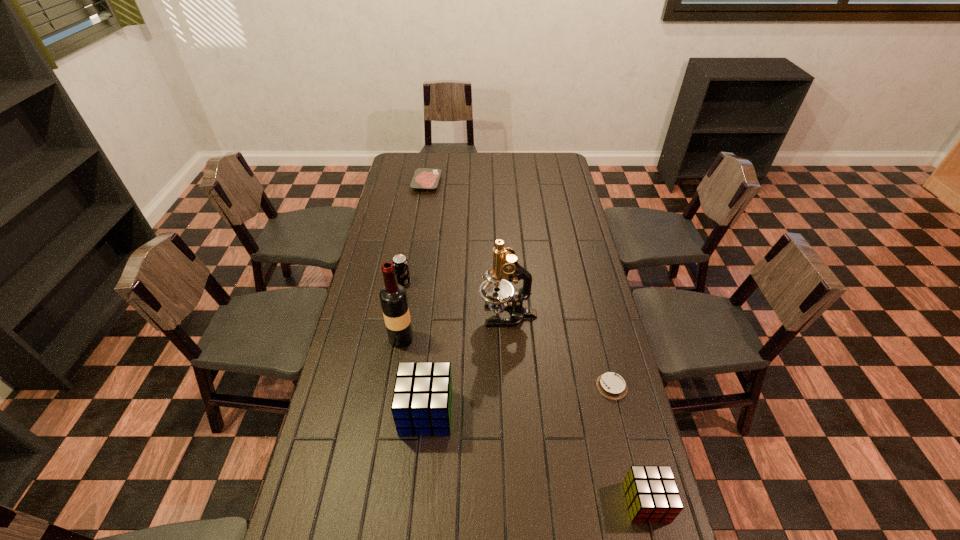
You are a GUI agent. You are given a task and a screenshot of the screen. Output one action in this format:
    pyautogui.click(x=<x>, y=<y>)
    Task: Click on the vacant area that lies between the third object from right to left and the right cube
    This screenshot has width=960, height=540.
    Given the screenshot: What is the action you would take?
    pyautogui.click(x=577, y=408)

Locate an element on the screen. The height and width of the screenshot is (540, 960). unoccupied position between the nearer cube and the fourth shortest object is located at coordinates (525, 393).

Select which object appears as the sixth closest to the sixth nearest object. Please provide its 2D coordinates. Your answer should be formatted as a tuple, i.e. [(x, y)], where the tuple contains the x and y coordinates of a point satisfying the conditions above.

[(652, 495)]

Select which object appears as the fifth closest to the fourth tallest object. Please provide its 2D coordinates. Your answer should be formatted as a tuple, i.e. [(x, y)], where the tuple contains the x and y coordinates of a point satisfying the conditions above.

[(611, 385)]

This screenshot has height=540, width=960. Identify the location of vacant space that satisfies the following two spatial constraints: 1. at the eyepiece of the fifth tallest object; 2. on the left side of the third object from right to left. (518, 502).

I want to click on free space that satisfies the following two spatial constraints: 1. on the back side of the farthest object; 2. on the right side of the sixth nearest object, so click(x=421, y=183).

You are a GUI agent. You are given a task and a screenshot of the screen. Output one action in this format:
    pyautogui.click(x=<x>, y=<y>)
    Task: Click on the free space that satisfies the following two spatial constraints: 1. on the front side of the farthest object; 2. on the left side of the chocolate cake
    The width and height of the screenshot is (960, 540).
    Given the screenshot: What is the action you would take?
    click(x=394, y=386)

Find the location of `vacant position in the image that satisfies the following two spatial constraints: 1. at the eyepiece of the fifth object from left to right; 2. on the front side of the wine bottle`. vacant position in the image that satisfies the following two spatial constraints: 1. at the eyepiece of the fifth object from left to right; 2. on the front side of the wine bottle is located at coordinates (509, 339).

Locate an element on the screen. This screenshot has height=540, width=960. free space that satisfies the following two spatial constraints: 1. at the eyepiece of the fifth object from left to right; 2. on the back side of the chocolate cake is located at coordinates (512, 386).